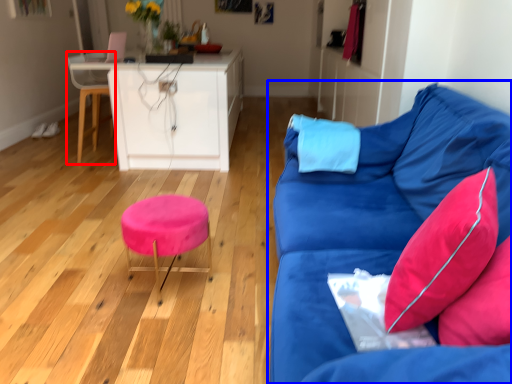
Question: Which object appears farthest to the camera in this image, swivel chair (highlighted by a red box) or studio couch (highlighted by a blue box)?

Choices:
 (A) swivel chair
 (B) studio couch

Answer: (A)